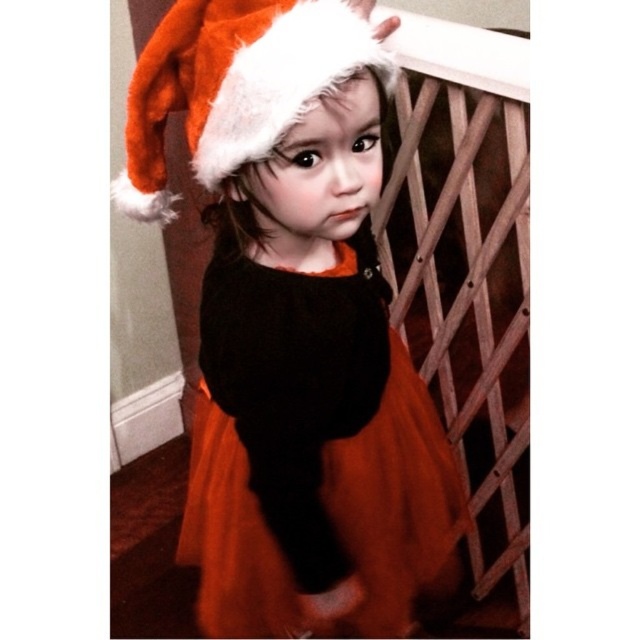
Question: Which object is the closest to the orange tulle dress at center?

Choices:
 (A) wooden lattice at upper right
 (B) fuzzy orange santa hat at upper center

Answer: (A)

Question: Can you confirm if wooden lattice at upper right is wider than fuzzy orange santa hat at upper center?

Choices:
 (A) no
 (B) yes

Answer: (B)

Question: Is wooden lattice at upper right to the right of orange tulle dress at center from the viewer's perspective?

Choices:
 (A) yes
 (B) no

Answer: (A)

Question: Is orange tulle dress at center bigger than fuzzy orange santa hat at upper center?

Choices:
 (A) yes
 (B) no

Answer: (A)

Question: Estimate the real-world distances between objects in this image. Which object is closer to the fuzzy orange santa hat at upper center?

Choices:
 (A) orange tulle dress at center
 (B) wooden lattice at upper right

Answer: (A)

Question: Which point appears closest to the camera in this image?

Choices:
 (A) (161, 177)
 (B) (516, 460)

Answer: (A)